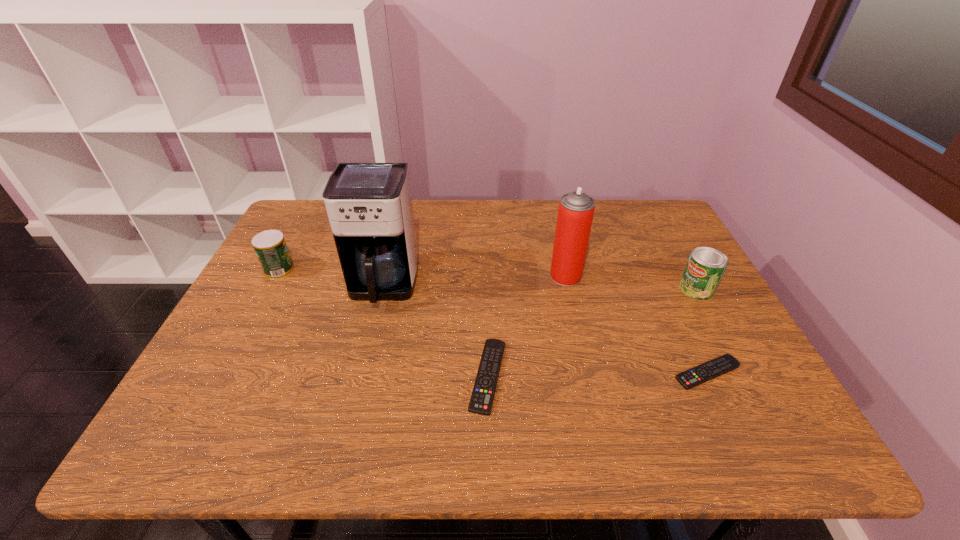
Locate an element on the screen. The image size is (960, 540). vacant space in between the coffee maker and the second shortest object is located at coordinates (436, 330).

In order to click on vacant space that is in between the right can and the leftmost object in this screenshot , I will do `click(488, 280)`.

This screenshot has height=540, width=960. Find the location of `vacant region between the fifth shortest object and the fifth object from right to left`. vacant region between the fifth shortest object and the fifth object from right to left is located at coordinates (474, 280).

Image resolution: width=960 pixels, height=540 pixels. Identify the location of free space between the right can and the shortest object. (702, 330).

In order to click on blank region between the right can and the left can in this screenshot , I will do `click(488, 280)`.

Locate an element on the screen. This screenshot has height=540, width=960. the second closest object to the aerosol can is located at coordinates (706, 266).

Select which object is the third closest to the second shortest object. Please provide its 2D coordinates. Your answer should be formatted as a tuple, i.e. [(x, y)], where the tuple contains the x and y coordinates of a point satisfying the conditions above.

[(707, 371)]

The height and width of the screenshot is (540, 960). What are the coordinates of `free space that satisfies the following two spatial constraints: 1. on the front panel of the taller remote control; 2. on the left side of the coffee maker` in the screenshot? It's located at (361, 376).

Where is `blank area in the image that satisfies the following two spatial constraints: 1. on the front panel of the right can; 2. on the left side of the fifth object from right to left`? blank area in the image that satisfies the following two spatial constraints: 1. on the front panel of the right can; 2. on the left side of the fifth object from right to left is located at coordinates (382, 289).

This screenshot has height=540, width=960. I want to click on vacant space that satisfies the following two spatial constraints: 1. on the front side of the left can; 2. on the right side of the fourth object from left to right, so click(276, 276).